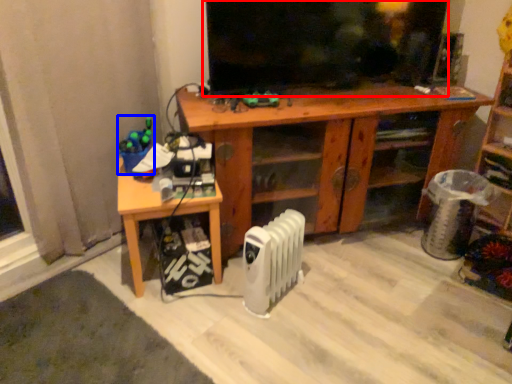
Question: Which of the following is the farthest to the observer, tv show (highlighted by a red box) or toy (highlighted by a blue box)?

Choices:
 (A) tv show
 (B) toy

Answer: (B)